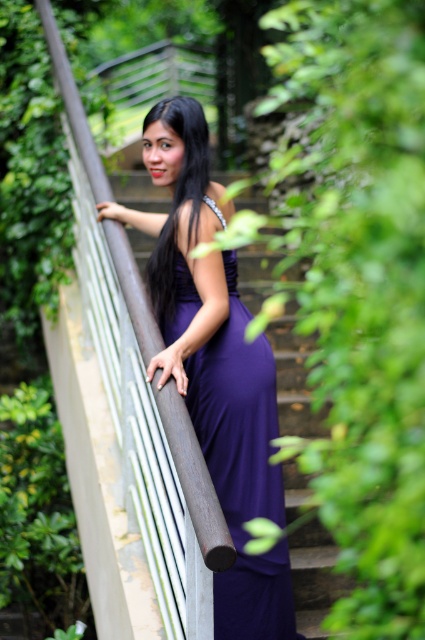
Is purple satin dress at center wider than black silky hair at upper center?

Yes, purple satin dress at center is wider than black silky hair at upper center.

What do you see at coordinates (215, 365) in the screenshot? This screenshot has height=640, width=425. I see `purple satin dress at center` at bounding box center [215, 365].

Between point (235, 472) and point (198, 179), which one is positioned in front?

Positioned in front is point (235, 472).

This screenshot has width=425, height=640. Identify the location of purple satin dress at center. (215, 365).